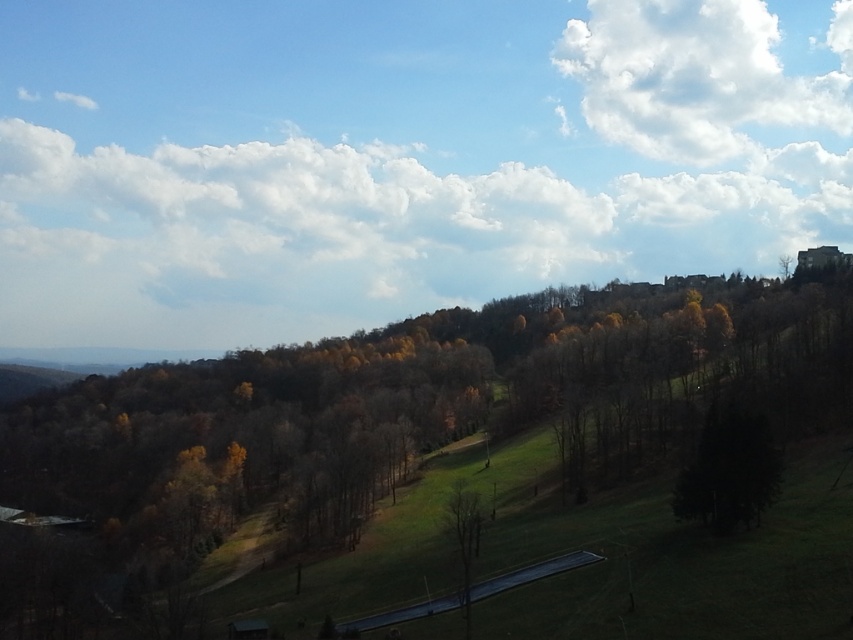
Question: Observing the image, what is the correct spatial positioning of dark green textured tree at lower right in reference to bare wood tree at center?

Choices:
 (A) right
 (B) left

Answer: (A)

Question: Which of the following is the farthest from the observer?

Choices:
 (A) (602, 360)
 (B) (721, 472)
 (C) (688, 45)
 (D) (467, 502)

Answer: (C)

Question: Which object is closer to the camera taking this photo?

Choices:
 (A) bare wood tree at center
 (B) dark green textured tree at lower right
 (C) brown matte tree at center

Answer: (A)

Question: Can you confirm if white fluffy cloud at upper right is wider than bare wood tree at center?

Choices:
 (A) yes
 (B) no

Answer: (A)

Question: Which point is farther from the camera taking this photo?

Choices:
 (A) (460, 602)
 (B) (759, 424)
 (C) (717, 33)
 (D) (503, 374)

Answer: (C)

Question: In this image, where is white fluffy cloud at upper right located relative to dark green textured tree at lower right?

Choices:
 (A) above
 (B) below

Answer: (A)